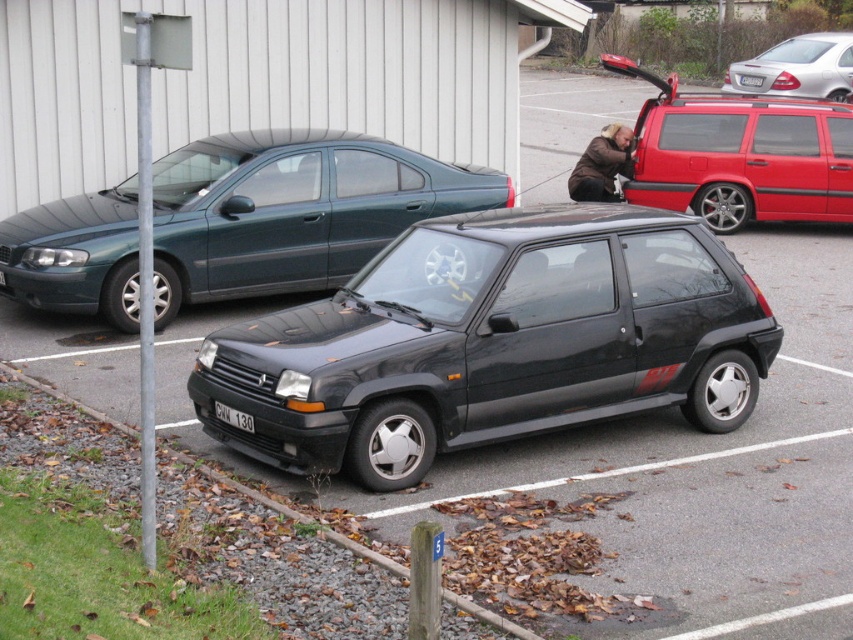
You are standing at the point with coordinates [740,154] in the parking lot. Which vehicle are you closest to?

The point at coordinates [740,154] corresponds to the metallic red SUV at upper right, so you are closest to the metallic red SUV at upper right.

You are a parking attendant who needs to direct a driver to their car. The driver mentions they have a silver metallic sedan at upper right and a white plastic license plate at center. Based on the scene, which car should you point to?

The silver metallic sedan at upper right is in front of the white plastic license plate at center, so you should point to the silver metallic sedan at upper right.

You are a pedestrian standing at the edge of the parking lot and see the gravel at lower left and the brown leather jacket at center. Which object is closer to your left side?

The gravel at lower left is closer to your left side because it is positioned to the left of the brown leather jacket at center.